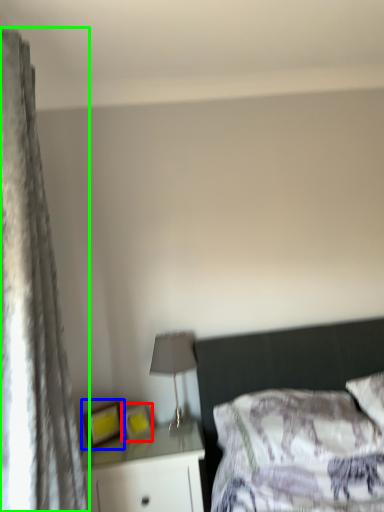
Question: Which object is positioned farthest from picture frame (highlighted by a red box)? Select from picture frame (highlighted by a blue box) and curtain (highlighted by a green box).

Choices:
 (A) picture frame
 (B) curtain

Answer: (B)